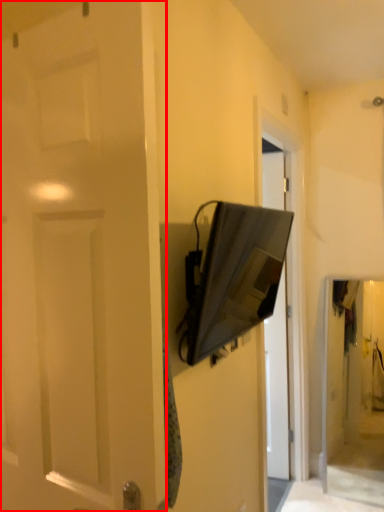
Question: From the image's perspective, what is the correct spatial positioning of door (annotated by the red box) in reference to medicine cabinet?

Choices:
 (A) above
 (B) below

Answer: (B)